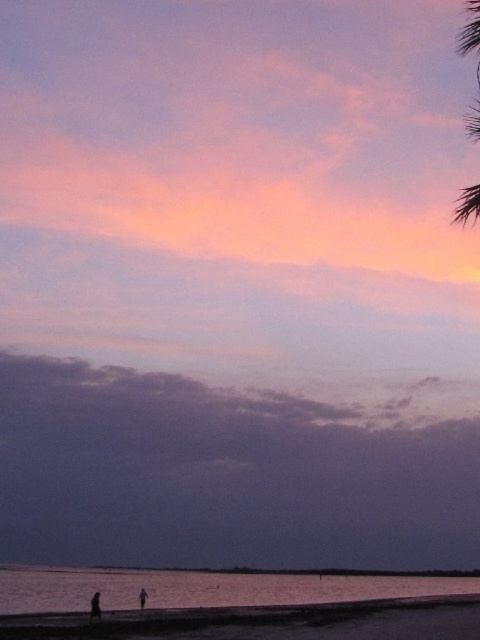
Question: Can you confirm if sandy beach at lower center is positioned to the right of silhouette figure at lower center?

Choices:
 (A) yes
 (B) no

Answer: (A)

Question: Can you confirm if silhouette figure at lower left is positioned below silhouette figure at lower center?

Choices:
 (A) yes
 (B) no

Answer: (B)

Question: Considering the real-world distances, which object is closest to the silhouette figure at lower center?

Choices:
 (A) silhouette figure at lower left
 (B) sandy beach at lower center
 (C) silvery water at lower center
 (D) green leafy palm tree at upper right

Answer: (A)

Question: Which point appears farthest from the camera in this image?

Choices:
 (A) (229, 580)
 (B) (94, 604)

Answer: (A)

Question: Among these objects, which one is farthest from the camera?

Choices:
 (A) silhouette figure at lower left
 (B) sandy beach at lower center
 (C) silvery water at lower center
 (D) green leafy palm tree at upper right

Answer: (A)

Question: Is green leafy palm tree at upper right positioned before silhouette figure at lower center?

Choices:
 (A) no
 (B) yes

Answer: (B)